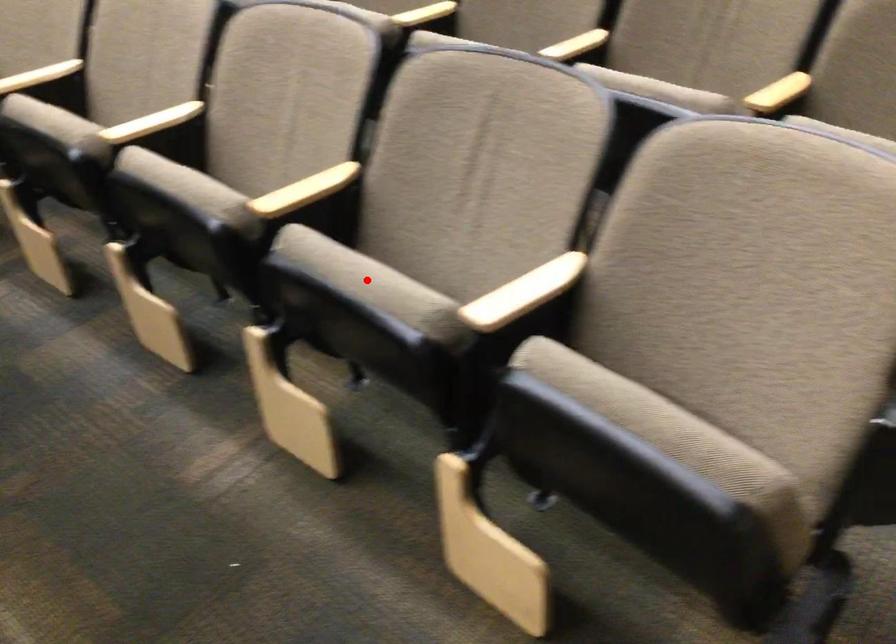
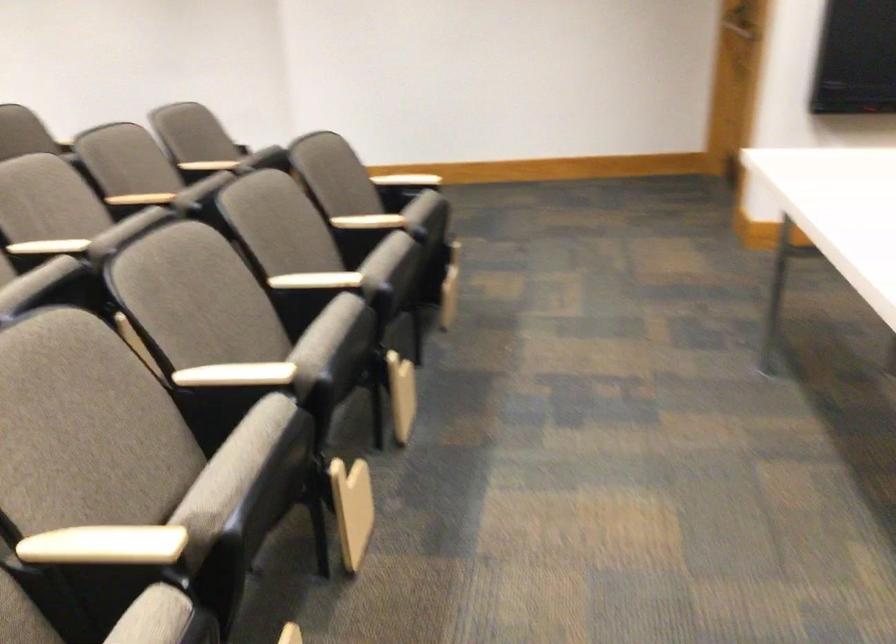
Question: I am providing you with two images of the same scene from different viewpoints. A red point is marked on the first image. Is the red point's position out of view in image 2?

Choices:
 (A) Yes
 (B) No

Answer: (A)